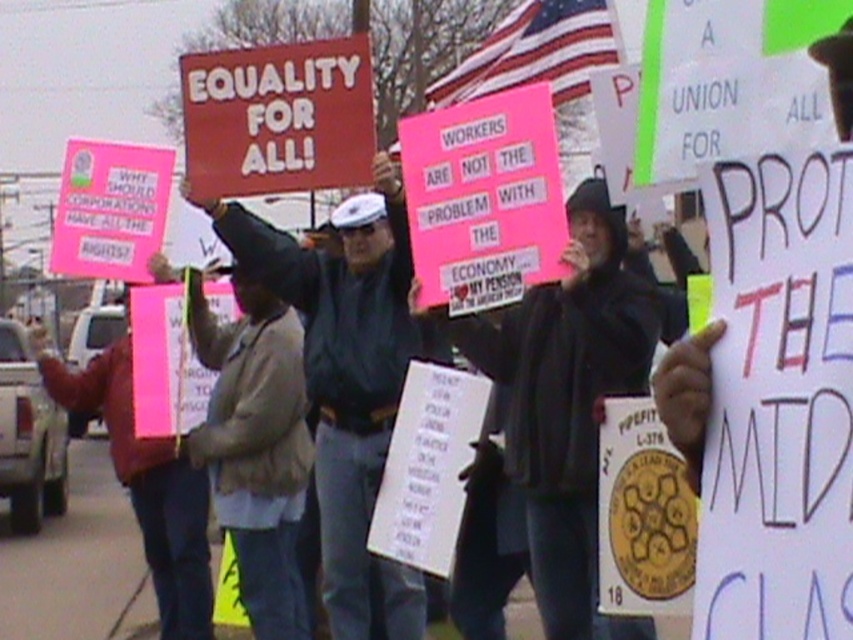
You are a photographer trying to capture a clear shot of the dark gray uniform at center and the red matte sign at center. Based on their positions, which object would you need to frame wider to ensure both are fully visible in the photo?

The dark gray uniform at center might be wider than the red matte sign at center, so you would need to frame the dark gray uniform at center wider to ensure it fits in the photo.

You are a photographer trying to capture the protest scene. You notice two items at the center of the image, the dark gray uniform at center and the tan suede jacket at center. Which item is visible on top of the other?

The dark gray uniform at center is positioned over tan suede jacket at center, so the dark gray uniform at center is visible on top.

You are a photographer trying to capture a photo of the protest. You notice two points in the scene at coordinates point (206, 435) and point (247, 112). Which point should you focus on to ensure the foreground subject is in sharp focus?

You should focus on point (247, 112) because it is in front of point (206, 435), making it the foreground subject.